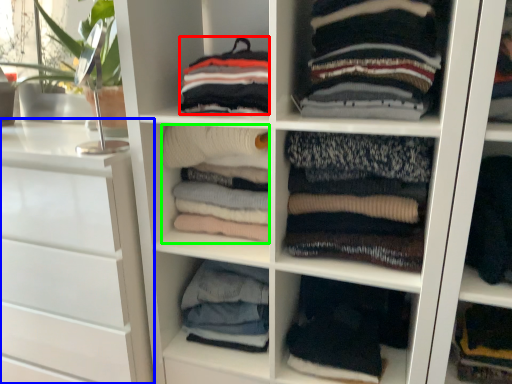
Question: Which is farther away from clothing (highlighted by a red box)? chest of drawers (highlighted by a blue box) or clothing (highlighted by a green box)?

Choices:
 (A) chest of drawers
 (B) clothing

Answer: (A)